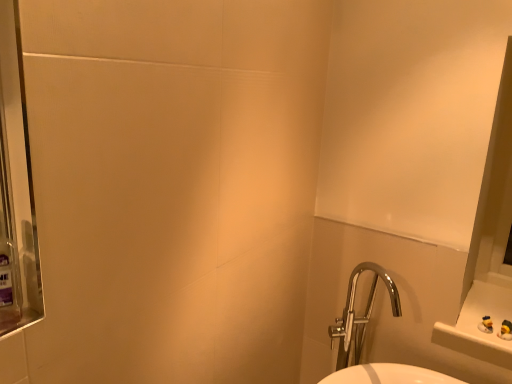
Find the location of a particular element. This screenshot has width=512, height=384. translucent purple mouthwash at left is located at coordinates (8, 276).

This screenshot has height=384, width=512. What do you see at coordinates (8, 276) in the screenshot?
I see `translucent purple mouthwash at left` at bounding box center [8, 276].

The image size is (512, 384). What are the coordinates of `chrome metallic sink at lower right` in the screenshot? It's located at (364, 340).

What do you see at coordinates (364, 340) in the screenshot? The image size is (512, 384). I see `chrome metallic sink at lower right` at bounding box center [364, 340].

Image resolution: width=512 pixels, height=384 pixels. Find the location of `translucent purple mouthwash at left`. translucent purple mouthwash at left is located at coordinates (8, 276).

Does translucent purple mouthwash at left appear on the left side of chrome metallic sink at lower right?

Yes.

Which is in front, translucent purple mouthwash at left or chrome metallic sink at lower right?

translucent purple mouthwash at left is in front.

Which is closer, (3, 249) or (369, 297)?

The point (3, 249) is closer to the camera.

From the image's perspective, between translucent purple mouthwash at left and chrome metallic sink at lower right, which one is located above?

translucent purple mouthwash at left is shown above in the image.

From a real-world perspective, is translucent purple mouthwash at left physically located above or below chrome metallic sink at lower right?

translucent purple mouthwash at left is situated higher than chrome metallic sink at lower right in the real world.

From the picture: In terms of width, does translucent purple mouthwash at left look wider or thinner when compared to chrome metallic sink at lower right?

translucent purple mouthwash at left is thinner than chrome metallic sink at lower right.

Who is taller, translucent purple mouthwash at left or chrome metallic sink at lower right?

Standing taller between the two is chrome metallic sink at lower right.

Considering the sizes of objects translucent purple mouthwash at left and chrome metallic sink at lower right in the image provided, who is bigger, translucent purple mouthwash at left or chrome metallic sink at lower right?

chrome metallic sink at lower right.

Would you say translucent purple mouthwash at left is outside chrome metallic sink at lower right?

Yes, translucent purple mouthwash at left is not within chrome metallic sink at lower right.

Is the surface of translucent purple mouthwash at left in direct contact with chrome metallic sink at lower right?

No, translucent purple mouthwash at left is not with chrome metallic sink at lower right.

From the picture: Is translucent purple mouthwash at left facing away from chrome metallic sink at lower right?

No, translucent purple mouthwash at left is not facing the opposite direction of chrome metallic sink at lower right.

In the image, there is a chrome metallic sink at lower right. Find the location of `mouthwash above it (from the image's perspective)`. mouthwash above it (from the image's perspective) is located at coordinates (8, 276).

Is chrome metallic sink at lower right to the right of translucent purple mouthwash at left from the viewer's perspective?

Indeed, chrome metallic sink at lower right is positioned on the right side of translucent purple mouthwash at left.

Considering the relative positions of chrome metallic sink at lower right and translucent purple mouthwash at left in the image provided, is chrome metallic sink at lower right behind translucent purple mouthwash at left?

Yes.

Is point (423, 377) positioned after point (9, 257)?

Yes, point (423, 377) is farther from viewer.

From the image's perspective, is chrome metallic sink at lower right positioned above or below translucent purple mouthwash at left?

chrome metallic sink at lower right is situated lower than translucent purple mouthwash at left in the image.

From a real-world perspective, is chrome metallic sink at lower right physically located above or below translucent purple mouthwash at left?

chrome metallic sink at lower right is below translucent purple mouthwash at left.

Considering the sizes of chrome metallic sink at lower right and translucent purple mouthwash at left in the image, is chrome metallic sink at lower right wider or thinner than translucent purple mouthwash at left?

Clearly, chrome metallic sink at lower right has more width compared to translucent purple mouthwash at left.

Consider the image. Considering the relative sizes of chrome metallic sink at lower right and translucent purple mouthwash at left in the image provided, is chrome metallic sink at lower right shorter than translucent purple mouthwash at left?

Incorrect, the height of chrome metallic sink at lower right does not fall short of that of translucent purple mouthwash at left.

Which of these two, chrome metallic sink at lower right or translucent purple mouthwash at left, is bigger?

chrome metallic sink at lower right is bigger.

Consider the image. Do you think chrome metallic sink at lower right is within translucent purple mouthwash at left, or outside of it?

chrome metallic sink at lower right cannot be found inside translucent purple mouthwash at left.

Does chrome metallic sink at lower right touch translucent purple mouthwash at left?

No, chrome metallic sink at lower right is not next to translucent purple mouthwash at left.

Is chrome metallic sink at lower right facing towards translucent purple mouthwash at left?

Yes, chrome metallic sink at lower right is facing translucent purple mouthwash at left.

Measure the distance from chrome metallic sink at lower right to translucent purple mouthwash at left.

chrome metallic sink at lower right and translucent purple mouthwash at left are 1.34 meters apart from each other.

Where is `sink below the translucent purple mouthwash at left (from the image's perspective)`? This screenshot has height=384, width=512. sink below the translucent purple mouthwash at left (from the image's perspective) is located at coordinates (364, 340).

The width and height of the screenshot is (512, 384). Identify the location of mouthwash in front of the chrome metallic sink at lower right. (8, 276).

This screenshot has height=384, width=512. I want to click on sink below the translucent purple mouthwash at left (from a real-world perspective), so click(x=364, y=340).